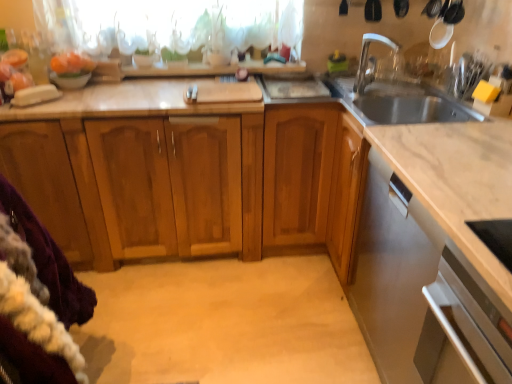
Question: Considering the relative sizes of satin silver dishwasher at lower right and white glossy faucet at upper right in the image provided, is satin silver dishwasher at lower right wider than white glossy faucet at upper right?

Choices:
 (A) yes
 (B) no

Answer: (A)

Question: Considering the relative positions of satin silver dishwasher at lower right and white glossy faucet at upper right in the image provided, is satin silver dishwasher at lower right to the right of white glossy faucet at upper right from the viewer's perspective?

Choices:
 (A) yes
 (B) no

Answer: (A)

Question: From a real-world perspective, does satin silver dishwasher at lower right sit lower than white glossy faucet at upper right?

Choices:
 (A) yes
 (B) no

Answer: (A)

Question: Is satin silver dishwasher at lower right positioned behind white glossy faucet at upper right?

Choices:
 (A) yes
 (B) no

Answer: (B)

Question: From the image's perspective, does satin silver dishwasher at lower right appear higher than white glossy faucet at upper right?

Choices:
 (A) no
 (B) yes

Answer: (A)

Question: Considering the relative positions of purple fleece blanket at lower left and satin silver oven at lower right in the image provided, is purple fleece blanket at lower left to the left or to the right of satin silver oven at lower right?

Choices:
 (A) right
 (B) left

Answer: (B)

Question: Considering the positions of point (0, 334) and point (500, 339), is point (0, 334) closer or farther from the camera than point (500, 339)?

Choices:
 (A) farther
 (B) closer

Answer: (B)

Question: From the image's perspective, is purple fleece blanket at lower left above or below satin silver oven at lower right?

Choices:
 (A) below
 (B) above

Answer: (B)

Question: Is purple fleece blanket at lower left inside the boundaries of satin silver oven at lower right, or outside?

Choices:
 (A) outside
 (B) inside

Answer: (A)

Question: Looking at their shapes, would you say translucent fabric at upper center is wider or thinner than white glossy bowl at upper left?

Choices:
 (A) thin
 (B) wide

Answer: (A)

Question: Based on their positions, is translucent fabric at upper center located to the left or right of white glossy bowl at upper left?

Choices:
 (A) right
 (B) left

Answer: (A)

Question: Would you say translucent fabric at upper center is inside or outside white glossy bowl at upper left?

Choices:
 (A) outside
 (B) inside

Answer: (A)

Question: From a real-world perspective, is translucent fabric at upper center positioned above or below white glossy bowl at upper left?

Choices:
 (A) above
 (B) below

Answer: (A)

Question: In terms of height, does purple fleece blanket at lower left look taller or shorter compared to orange matte bowl at upper left?

Choices:
 (A) short
 (B) tall

Answer: (B)

Question: In the image, is purple fleece blanket at lower left positioned in front of or behind orange matte bowl at upper left?

Choices:
 (A) front
 (B) behind

Answer: (A)